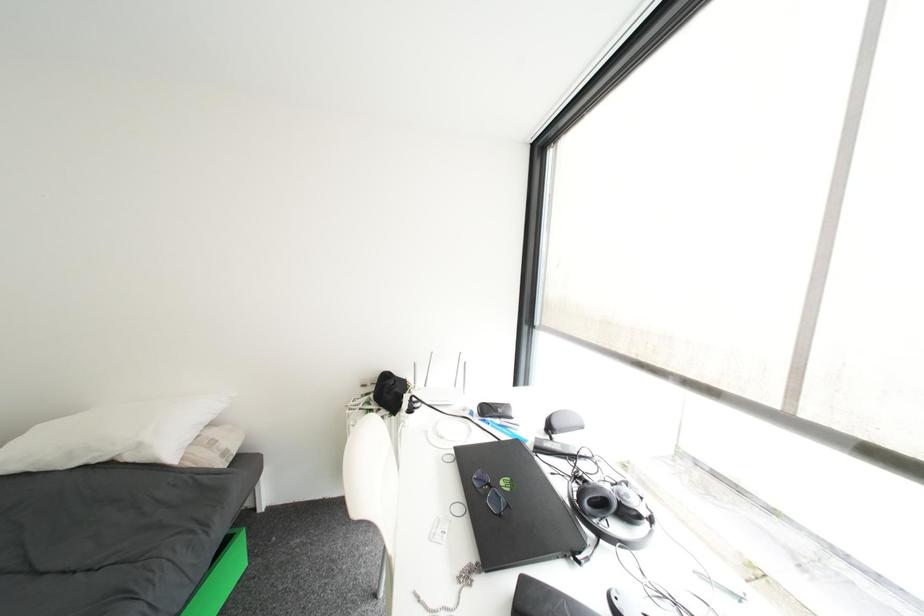
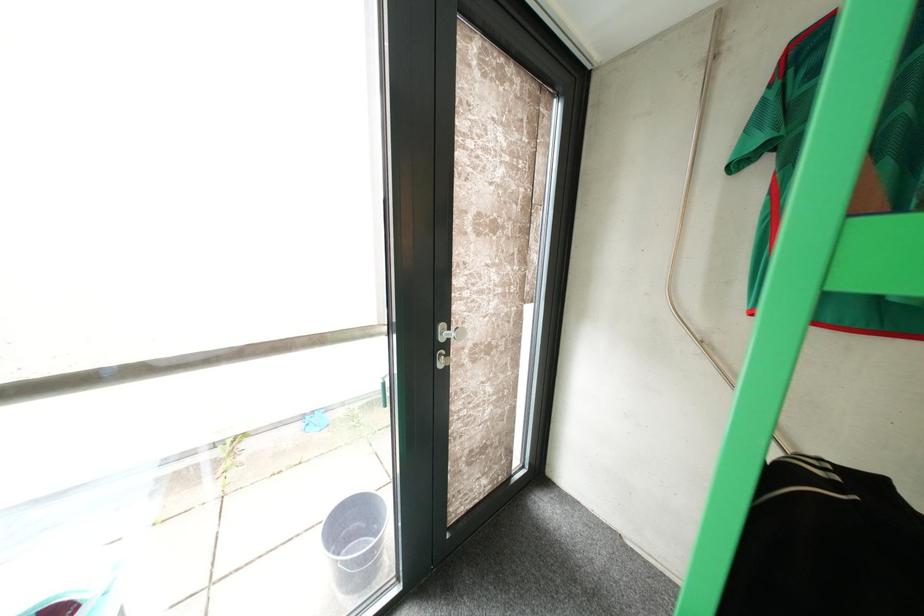
The first image is from the beginning of the video and the second image is from the end. How did the camera likely rotate when shooting the video?

The camera's rotation is toward right-down.